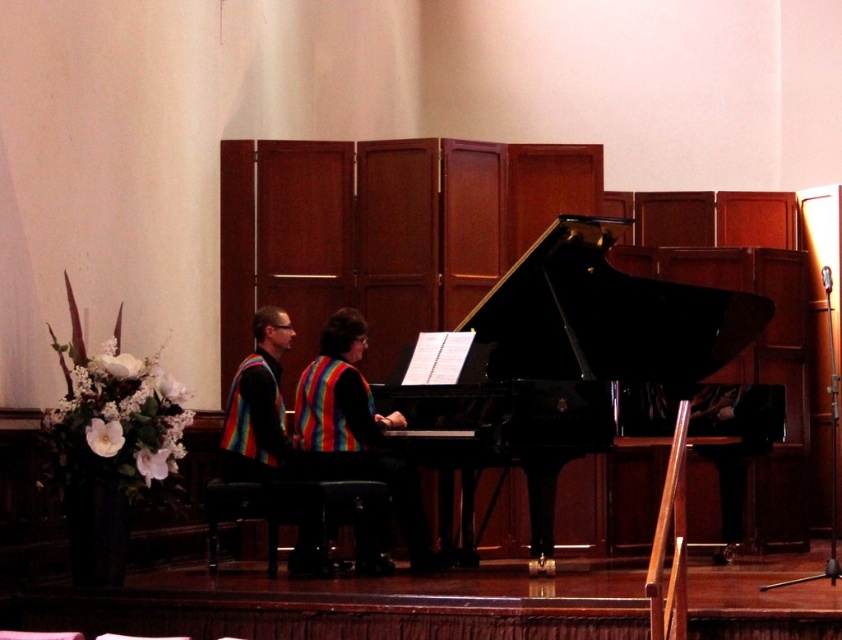
Between point (386, 467) and point (276, 339), which one is positioned in front?

Point (386, 467) is more forward.

Is rainbow striped vest at center further to the viewer compared to rainbow fabric vest at center?

No, rainbow striped vest at center is in front of rainbow fabric vest at center.

At what (x,y) coordinates should I click in order to perform the action: click on rainbow striped vest at center. Please return your answer as a coordinate pair (x, y). The width and height of the screenshot is (842, 640). Looking at the image, I should click on (354, 429).

Is point (462, 365) farther from camera compared to point (246, 380)?

That is True.

Does black polished piano at center come behind rainbow fabric vest at center?

That is False.

Which is in front, point (574, 305) or point (244, 416)?

Point (244, 416) is more forward.

Where is `black polished piano at center`? The height and width of the screenshot is (640, 842). black polished piano at center is located at coordinates (585, 337).

Who is taller, black polished piano at center or rainbow striped vest at center?

rainbow striped vest at center

Is black polished piano at center further to the viewer compared to rainbow striped vest at center?

No, it is not.

Where is `black polished piano at center`? black polished piano at center is located at coordinates (585, 337).

Locate an element on the screen. This screenshot has height=640, width=842. black polished piano at center is located at coordinates (585, 337).